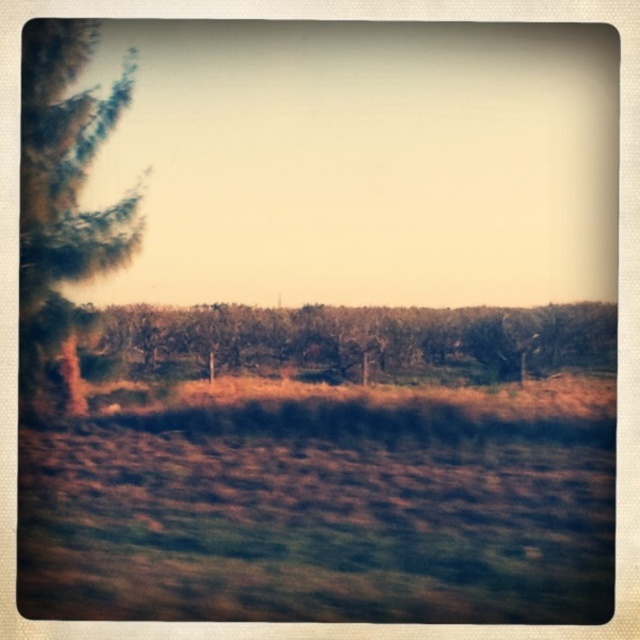
Does brown grass at lower center appear under green textured tree at left?

Correct, brown grass at lower center is located below green textured tree at left.

Between point (548, 416) and point (52, 220), which one is positioned in front?

Point (52, 220) is in front.

Which is behind, point (545, 502) or point (90, 131)?

The point (90, 131) is behind.

Find the location of `brown grass at lower center`. brown grass at lower center is located at coordinates (324, 506).

Which is below, brown grass at lower center or brown textured trees at center?

brown grass at lower center is below.

Does point (198, 403) come closer to viewer compared to point (506, 339)?

No.

In order to click on brown grass at lower center in this screenshot , I will do `click(324, 506)`.

Which of these two, brown textured trees at center or green textured tree at left, stands shorter?

Standing shorter between the two is brown textured trees at center.

Is point (499, 356) closer to viewer compared to point (35, 100)?

No, it is not.

Find the location of a particular element. brown textured trees at center is located at coordinates (364, 339).